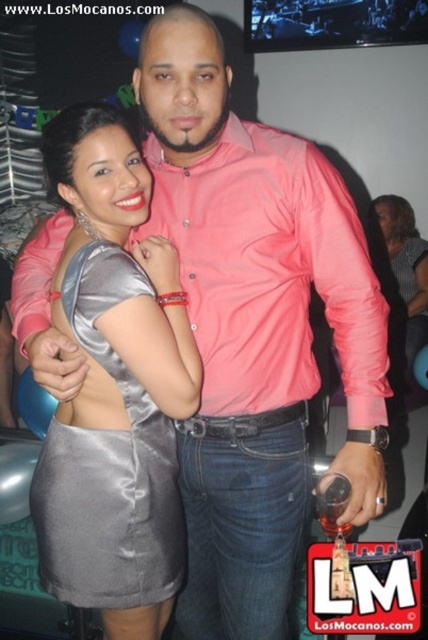
Question: Among these points, which one is farthest from the camera?

Choices:
 (A) (92, 428)
 (B) (404, 291)

Answer: (B)

Question: Observing the image, what is the correct spatial positioning of satin gray dress at center in reference to satin dress at center?

Choices:
 (A) above
 (B) below

Answer: (B)

Question: Among these objects, which one is farthest from the camera?

Choices:
 (A) satin dress at center
 (B) satin gray dress at center

Answer: (A)

Question: Can you confirm if satin gray dress at center is thinner than satin dress at center?

Choices:
 (A) yes
 (B) no

Answer: (B)

Question: Which of the following is the closest to the observer?

Choices:
 (A) (91, 580)
 (B) (380, 220)

Answer: (A)

Question: Is satin gray dress at center bigger than satin dress at center?

Choices:
 (A) yes
 (B) no

Answer: (B)